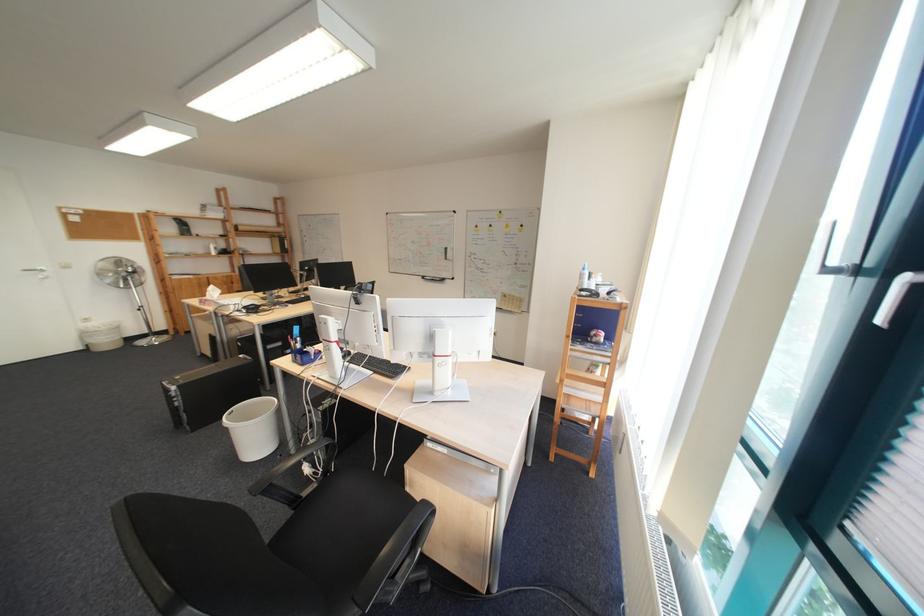
Which object does [209,392] point to?

It refers to a black computer tower.